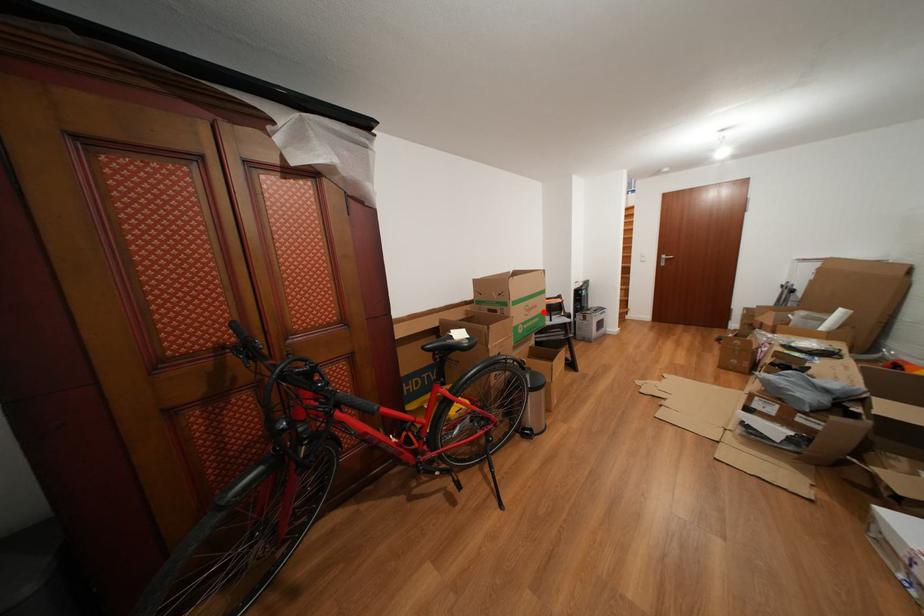
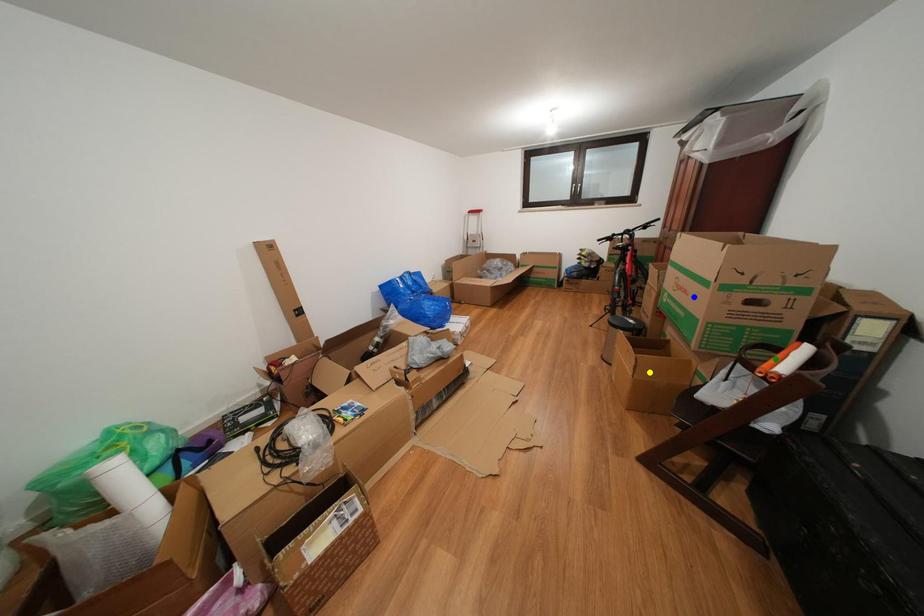
Question: I am providing you with two images of the same scene from different viewpoints. A red point is marked on the first image. You are given multiple points on the second image. Which mark in image 2 goes with the point in image 1?

Choices:
 (A) green point
 (B) yellow point
 (C) blue point

Answer: (C)